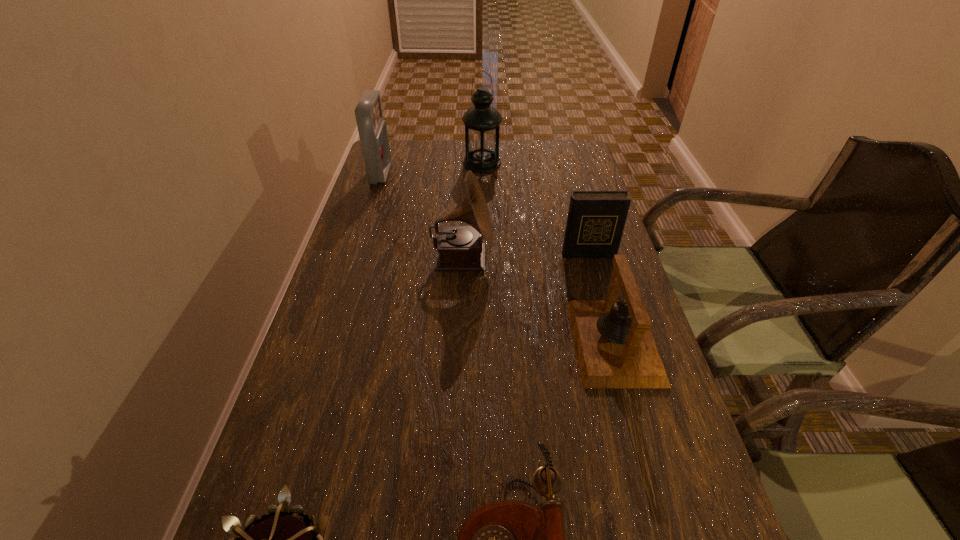
This screenshot has height=540, width=960. I want to click on vacant area between the third nearest object and the first-aid kit, so click(x=497, y=258).

Where is `unoccupied position between the third nearest object and the diary`? The width and height of the screenshot is (960, 540). unoccupied position between the third nearest object and the diary is located at coordinates click(601, 298).

Identify the location of free space that is in between the phonograph record and the diary. (525, 256).

What are the coordinates of `empty space between the tallest object and the bell` in the screenshot? It's located at (548, 253).

Locate which object is the sixth closest to the diary. Please provide its 2D coordinates. Your answer should be formatted as a tuple, i.e. [(x, y)], where the tuple contains the x and y coordinates of a point satisfying the conditions above.

[(278, 539)]

I want to click on object that stands as the fourth closest to the phonograph record, so click(481, 121).

This screenshot has height=540, width=960. I want to click on blank space that satisfies the following two spatial constraints: 1. on the front cover of the diary; 2. on the horn of the phonograph record, so click(589, 260).